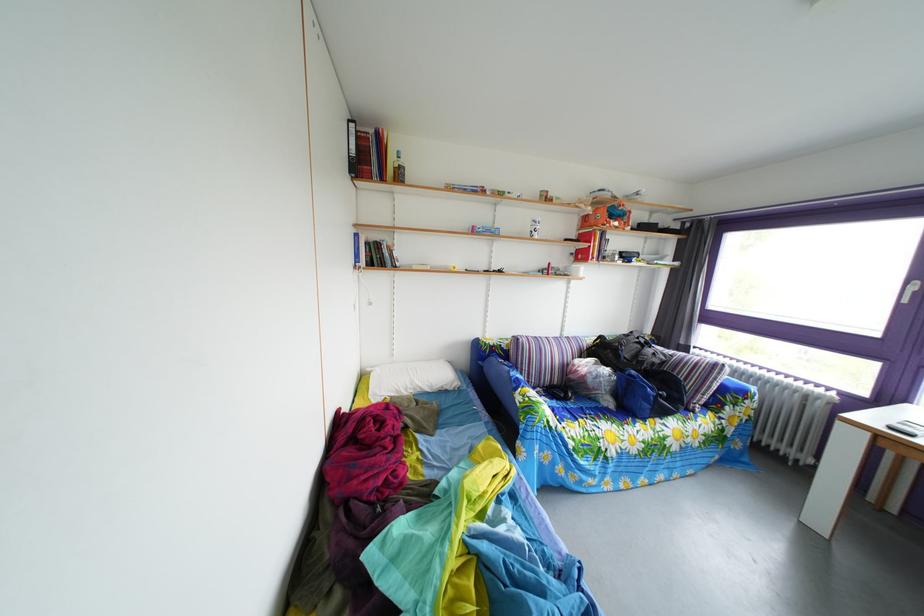
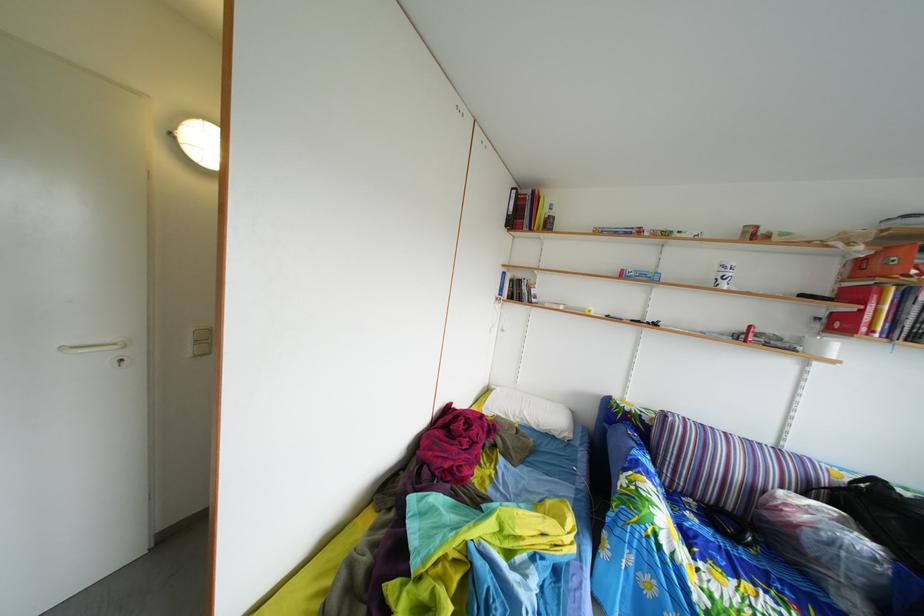
The point at (565, 391) is marked in the first image. Where is the corresponding point in the second image?

(739, 516)